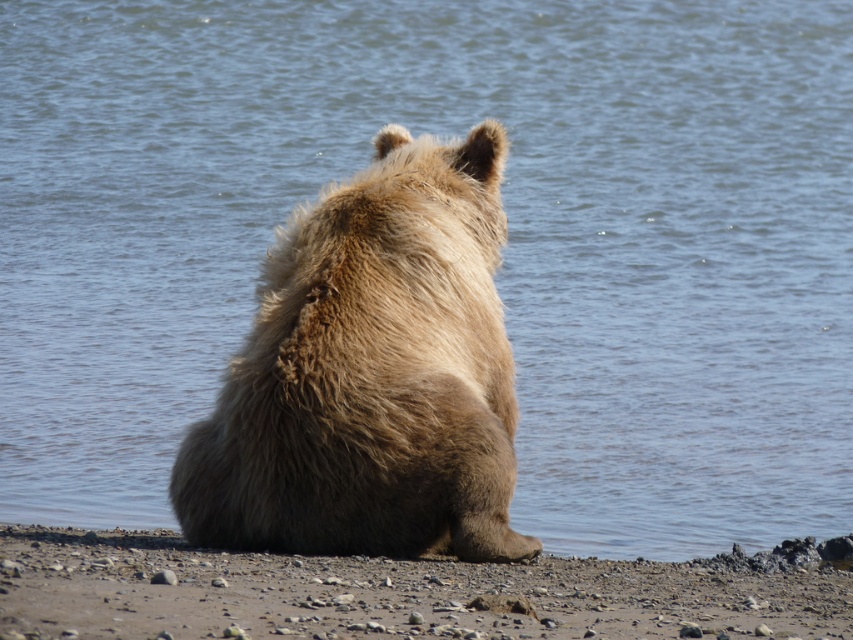
You are standing at the point marked by coordinates point [370,372] in the image. What do you see directly in front of you?

You see the fuzzy brown bear at center directly in front of you at the point marked by coordinates point [370,372].

You are a wildlife photographer trying to capture the fuzzy brown bear at center in your shot. You notice the brown gravelly sand at lower center is part of the foreground. Considering their sizes, which object will appear bigger in your photo?

The fuzzy brown bear at center will appear bigger in the photo since it has a larger size compared to the brown gravelly sand at lower center.